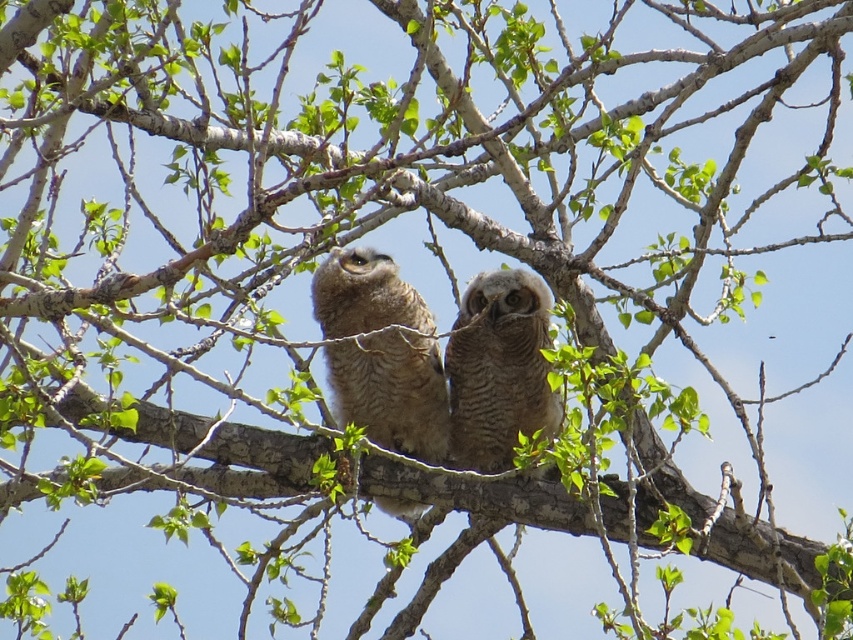
Looking at this image, you are a photographer trying to capture both owls in a single shot. You notice two points of interest marked as point 1 at coordinates (x=373, y=369) and point 2 at (x=531, y=371). Which point is closer to your camera lens?

Point 1 at coordinates (x=373, y=369) is closer to the camera lens than point 2 at (x=531, y=371) because it is further to the camera according to the description.